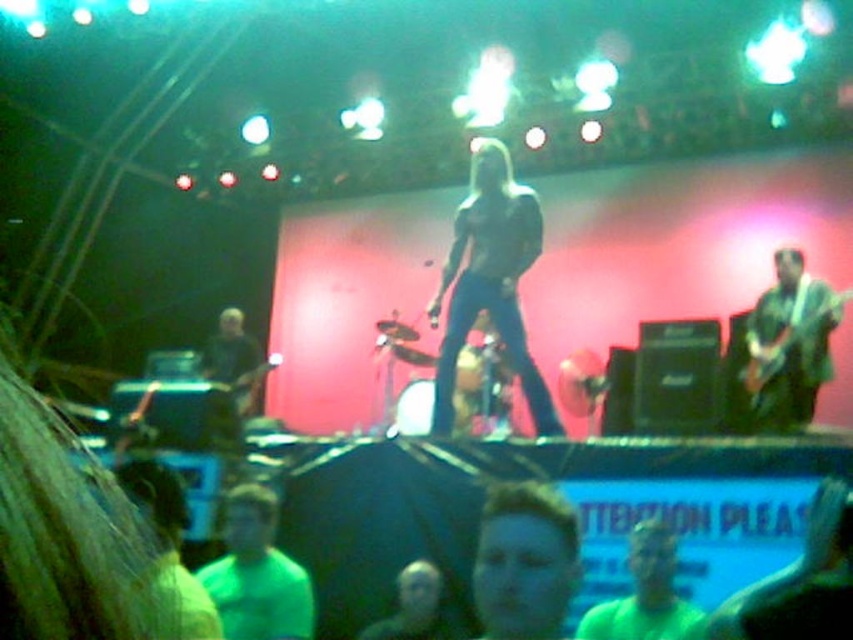
Question: Can you confirm if shiny black guitar at center is bigger than shiny green guitar at right?

Choices:
 (A) no
 (B) yes

Answer: (B)

Question: Is shiny black guitar at center to the left of shiny green guitar at right from the viewer's perspective?

Choices:
 (A) no
 (B) yes

Answer: (B)

Question: Does shiny black guitar at center appear under shiny green guitar at right?

Choices:
 (A) yes
 (B) no

Answer: (B)

Question: Among these objects, which one is nearest to the camera?

Choices:
 (A) shiny black guitar at center
 (B) shiny green guitar at right

Answer: (A)

Question: Which point appears farthest from the camera in this image?

Choices:
 (A) (769, 364)
 (B) (492, 221)

Answer: (A)